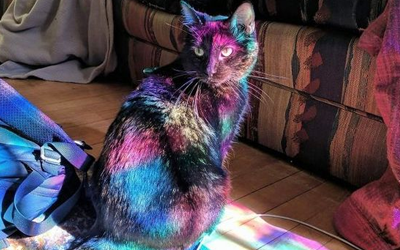
Find the location of a particular element. light gray blanket is located at coordinates (67, 10).